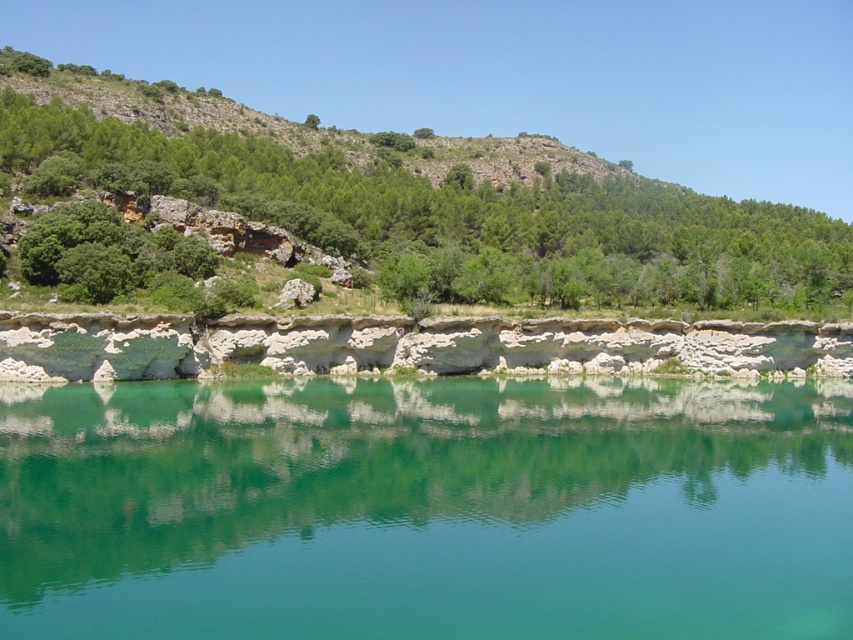
Question: Where is green smooth water at center located in relation to green leafy hillside at upper left in the image?

Choices:
 (A) below
 (B) above

Answer: (A)

Question: Does green smooth water at center have a lesser width compared to green leafy hillside at upper left?

Choices:
 (A) no
 (B) yes

Answer: (B)

Question: In this image, where is green smooth water at center located relative to green leafy hillside at upper left?

Choices:
 (A) right
 (B) left

Answer: (A)

Question: Which point is farther from the camera taking this photo?

Choices:
 (A) (28, 593)
 (B) (595, 298)

Answer: (B)

Question: Which of the following is the closest to the observer?

Choices:
 (A) green leafy hillside at upper left
 (B) green smooth water at center

Answer: (B)